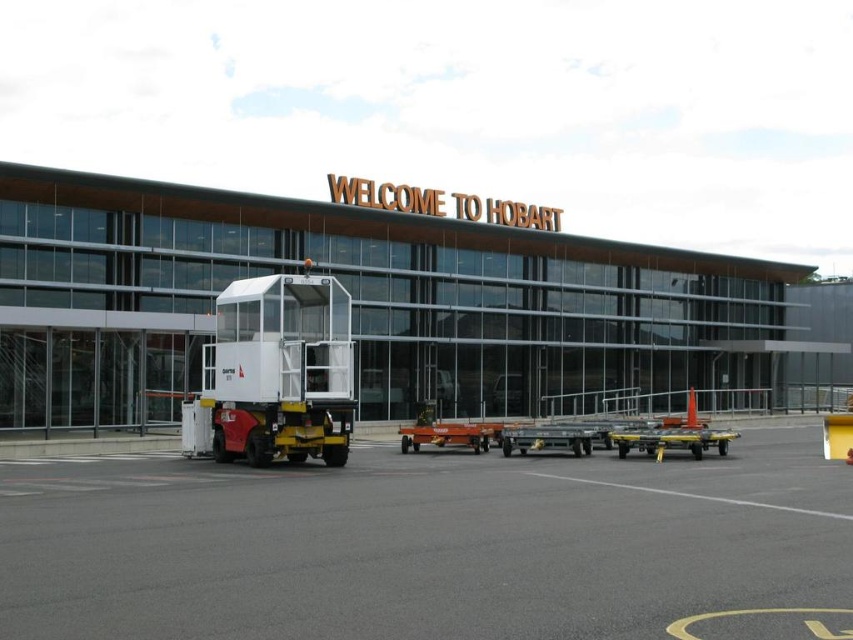
Which is more to the left, gray asphalt tarmac at center or matte glass airport terminal at center?

gray asphalt tarmac at center

Does gray asphalt tarmac at center appear on the left side of matte glass airport terminal at center?

Correct, you'll find gray asphalt tarmac at center to the left of matte glass airport terminal at center.

Is point (207, 486) more distant than point (614, 312)?

No, it is not.

The width and height of the screenshot is (853, 640). I want to click on gray asphalt tarmac at center, so click(431, 547).

Who is taller, gray asphalt tarmac at center or white plastic truck at center?

gray asphalt tarmac at center is taller.

Does gray asphalt tarmac at center appear on the left side of white plastic truck at center?

In fact, gray asphalt tarmac at center is to the right of white plastic truck at center.

Which is in front, point (154, 582) or point (241, 342)?

Positioned in front is point (154, 582).

Where is `gray asphalt tarmac at center`? This screenshot has width=853, height=640. gray asphalt tarmac at center is located at coordinates (431, 547).

Which of these two, matte glass airport terminal at center or white plastic truck at center, stands taller?

With more height is matte glass airport terminal at center.

Who is more distant from viewer, (x=380, y=291) or (x=287, y=339)?

Point (x=380, y=291)

You are a GUI agent. You are given a task and a screenshot of the screen. Output one action in this format:
    pyautogui.click(x=<x>, y=<y>)
    Task: Click on the matte glass airport terminal at center
    This screenshot has height=640, width=853.
    Given the screenshot: What is the action you would take?
    pyautogui.click(x=360, y=305)